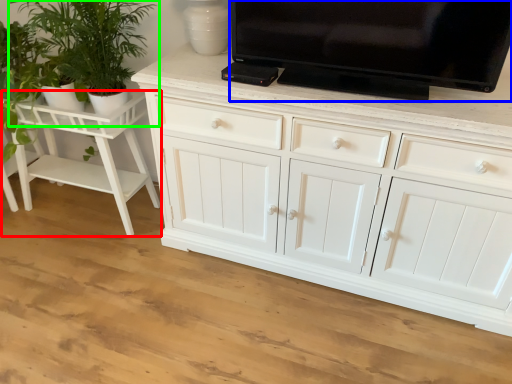
Question: Estimate the real-world distances between objects in this image. Which object is closer to vanity (highlighted by a red box), television (highlighted by a blue box) or houseplant (highlighted by a green box)?

Choices:
 (A) television
 (B) houseplant

Answer: (B)